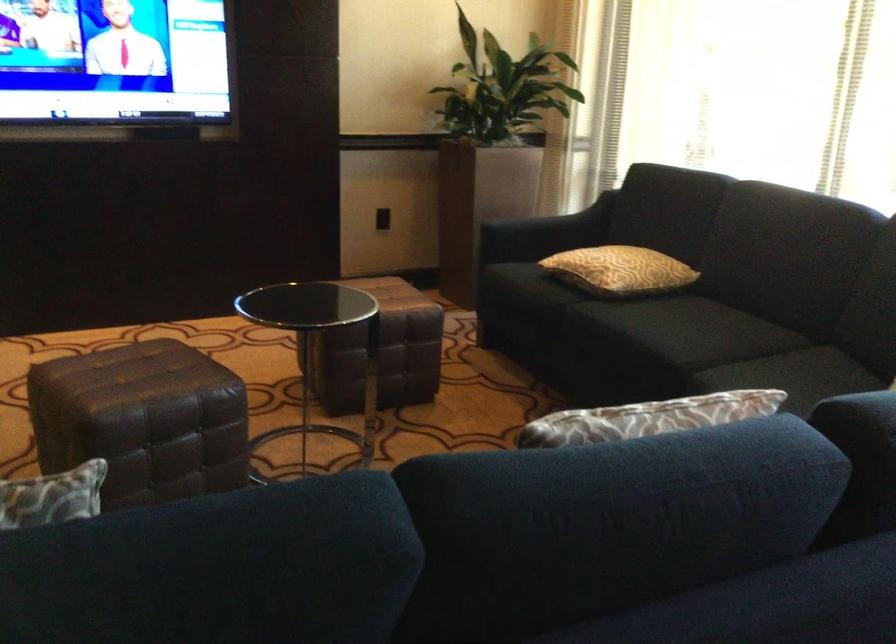
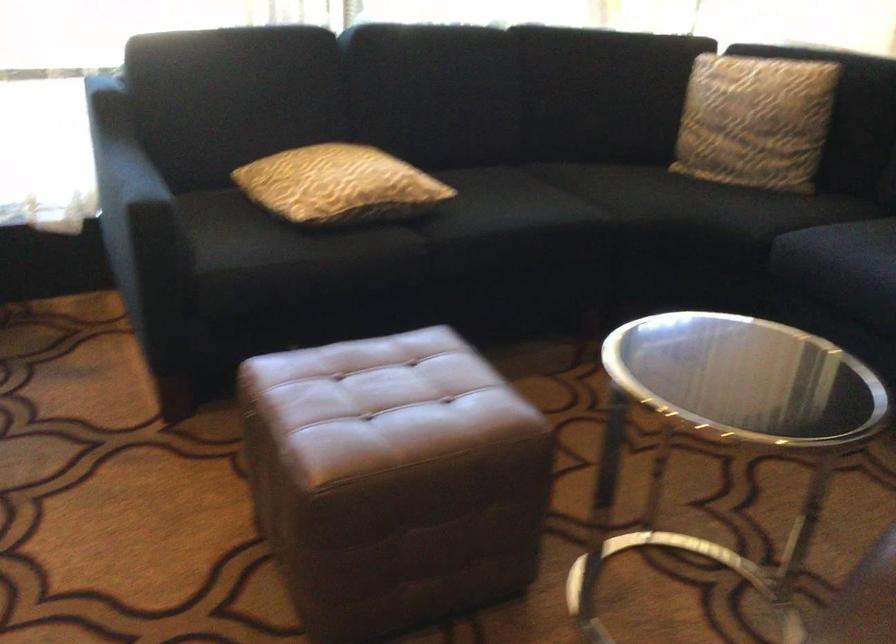
In the second image, find the point that corresponds to point (604, 305) in the first image.

(426, 227)